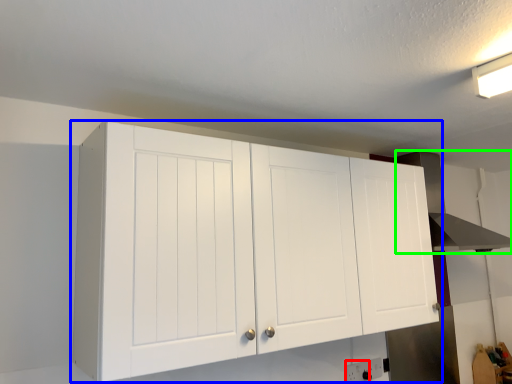
Question: Which object is positioned farthest from electric outlet (highlighted by a red box)? Select from cupboard (highlighted by a blue box) and vent (highlighted by a green box).

Choices:
 (A) cupboard
 (B) vent

Answer: (B)